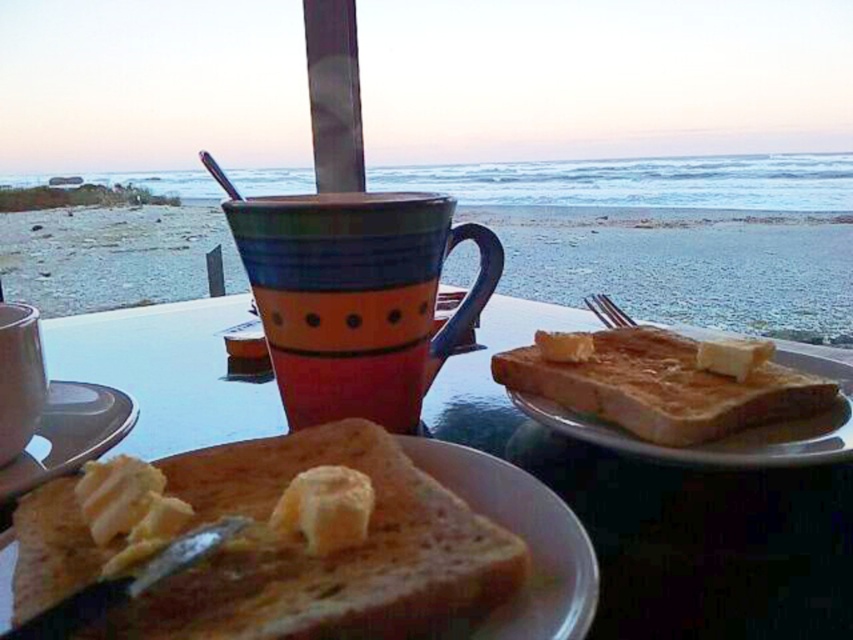
You are a person with a 25 cm long spoon. You want to reach the golden brown toast at right from where you are standing. Can you reach it with your spoon?

The golden brown toast at right is 24.57 centimeters from the viewer. Since your spoon is 25 cm long, you can just barely reach it.

You have a small plate and want to place both the matte ceramic mug at center and the golden brown toast at right on it. Which item will not fit due to size?

The matte ceramic mug at center has a larger size compared to golden brown toast at right, so it will not fit on the small plate.

You are a server at a beachside cafe. You need to deliver a matte ceramic mug at center and golden brown toast at right to a customer seated at the table. The customer asks if you can place both items on the table without them touching. The table is 1.5 meters long. Can you do it?

The matte ceramic mug at center is 1.21 meters away from the golden brown toast at right. Since the table is 1.5 meters long, there is enough space to place both items without them touching as the distance between them is less than the table length.